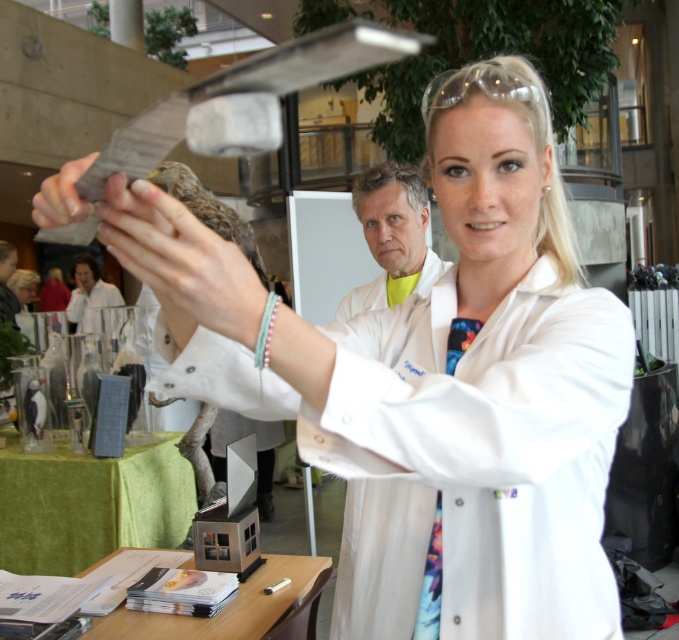
Question: Among these objects, which one is nearest to the camera?

Choices:
 (A) matte silver bird at center
 (B) matte black glove at upper left

Answer: (B)

Question: Which of the following is the farthest from the observer?

Choices:
 (A) yellow fabric at center
 (B) matte black glove at upper left
 (C) matte silver bird at center

Answer: (C)

Question: Can you confirm if yellow fabric at center is wider than matte black glove at upper left?

Choices:
 (A) no
 (B) yes

Answer: (B)

Question: Is matte silver bird at center positioned before matte black glove at upper left?

Choices:
 (A) yes
 (B) no

Answer: (B)

Question: Among these points, which one is nearest to the camera?

Choices:
 (A) (253, 264)
 (B) (71, 184)

Answer: (B)

Question: Is yellow fabric at center smaller than matte silver bird at center?

Choices:
 (A) no
 (B) yes

Answer: (B)